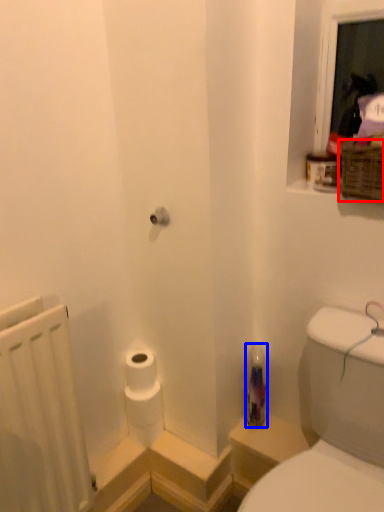
Question: Which point is closer to the camera, basket (highlighted by a red box) or bottle (highlighted by a blue box)?

Choices:
 (A) basket
 (B) bottle

Answer: (A)